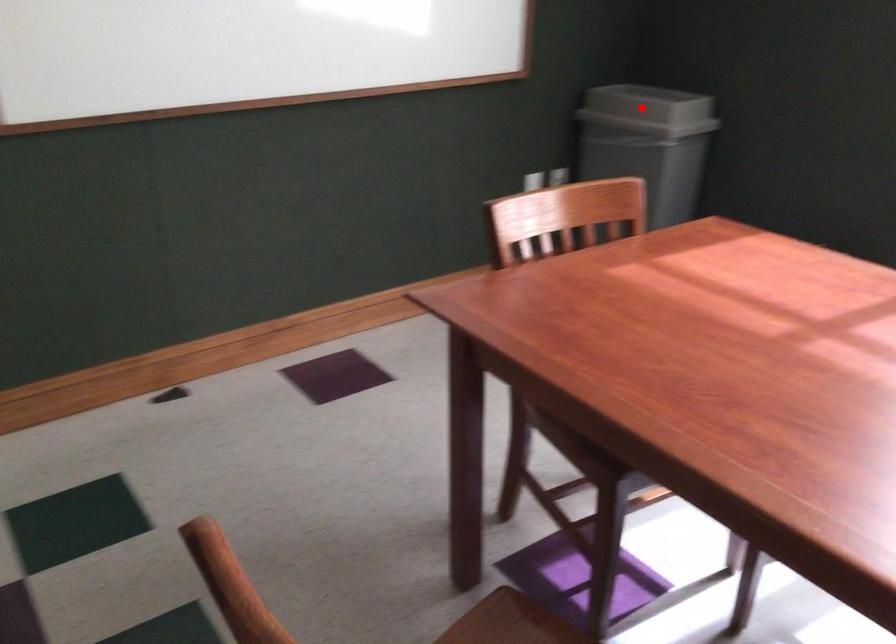
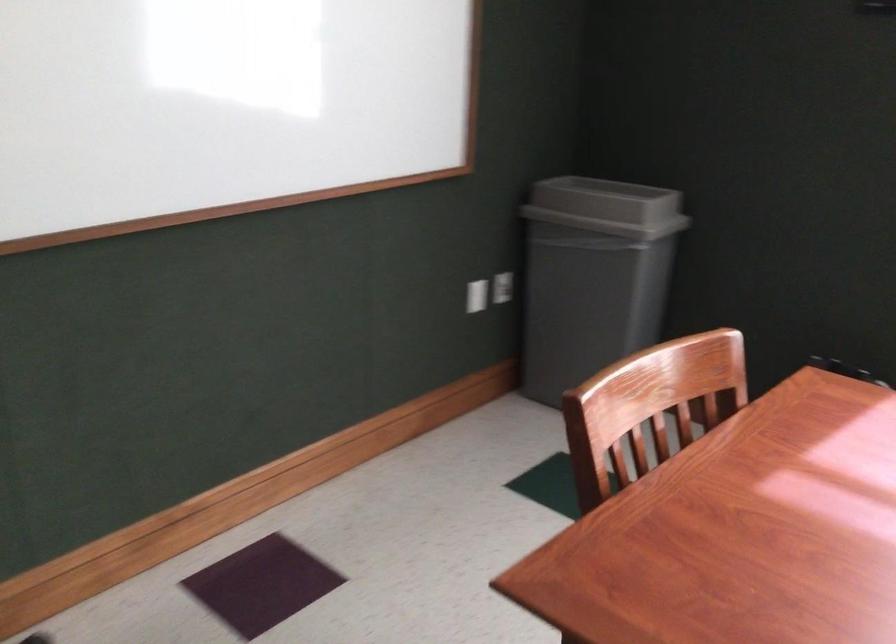
Locate, in the second image, the point that corresponds to the highlighted location in the first image.

(607, 207)